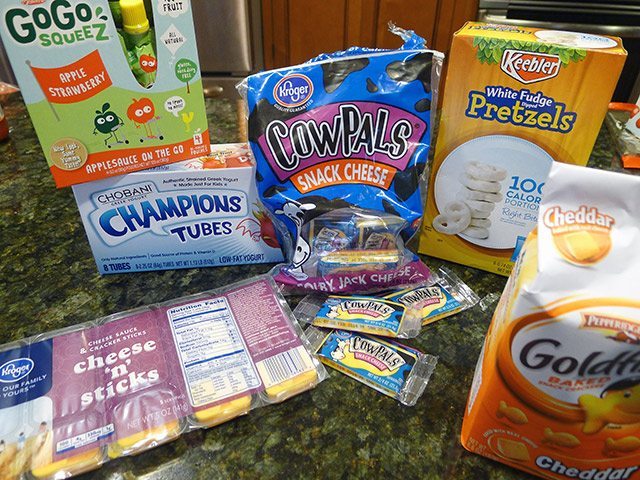
Locate an element on the screen. Image resolution: width=640 pixels, height=480 pixels. fridge is located at coordinates [226, 9].